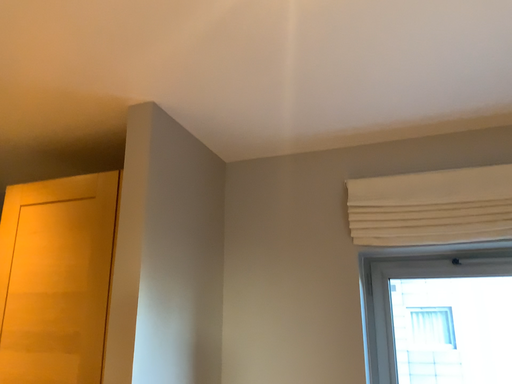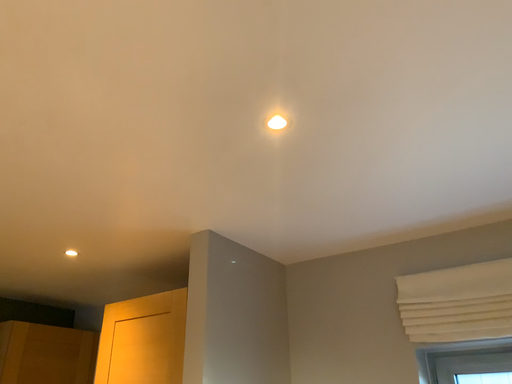
Question: Which way did the camera rotate in the video?

Choices:
 (A) rotated downward
 (B) rotated upward

Answer: (B)